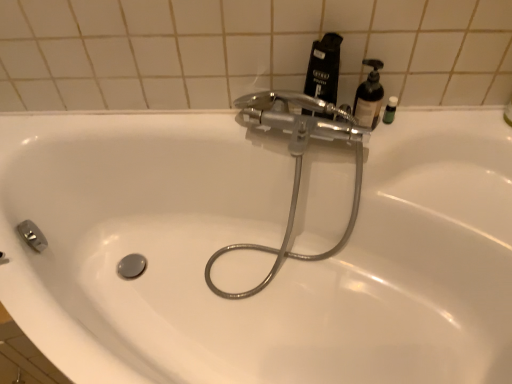
Question: Considering their positions, is green matte bottle at upper right located in front of or behind translucent plastic soap dispenser at upper right?

Choices:
 (A) front
 (B) behind

Answer: (B)

Question: Looking at their shapes, would you say green matte bottle at upper right is wider or thinner than translucent plastic soap dispenser at upper right?

Choices:
 (A) wide
 (B) thin

Answer: (B)

Question: Which of these objects is positioned closest to the green matte bottle at upper right?

Choices:
 (A) polished chrome faucet at upper center
 (B) black matte bottle at upper right
 (C) translucent plastic soap dispenser at upper right

Answer: (C)

Question: Which is farther from the black matte bottle at upper right?

Choices:
 (A) translucent plastic soap dispenser at upper right
 (B) polished chrome faucet at upper center
 (C) green matte bottle at upper right

Answer: (C)